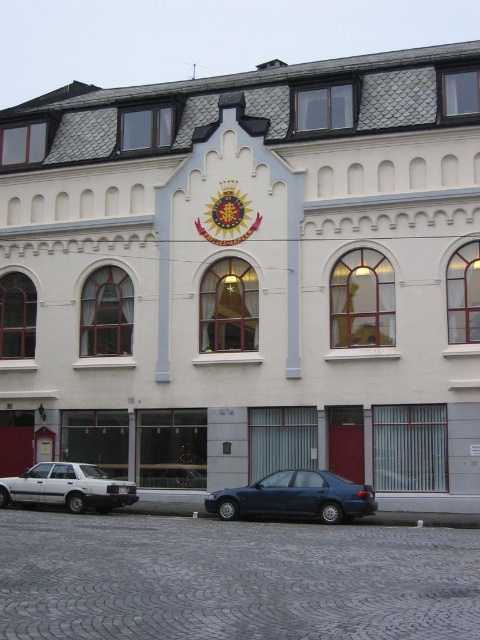
Question: Which point is farther from the camera taking this photo?

Choices:
 (A) (288, 486)
 (B) (66, 483)

Answer: (B)

Question: Which of the following is the closest to the observer?

Choices:
 (A) (105, 472)
 (B) (236, 497)

Answer: (B)

Question: Which of the following is the closest to the observer?

Choices:
 (A) (233, 488)
 (B) (17, 483)

Answer: (B)

Question: Does dark blue sedan at center have a lesser width compared to white matte sedan at lower left?

Choices:
 (A) no
 (B) yes

Answer: (B)

Question: Does dark blue sedan at center come behind white matte sedan at lower left?

Choices:
 (A) yes
 (B) no

Answer: (B)

Question: Does dark blue sedan at center appear over white matte sedan at lower left?

Choices:
 (A) no
 (B) yes

Answer: (B)